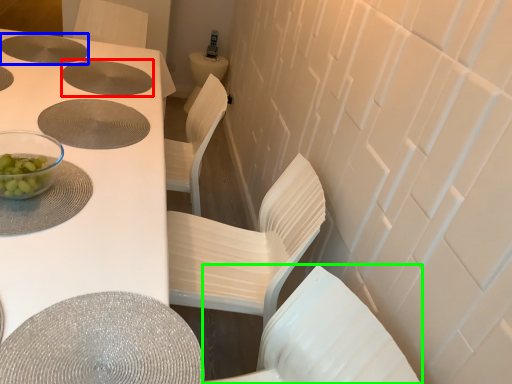
Question: Which object is positioned closest to hole (highlighted by a red box)? Select from hole (highlighted by a blue box) and chair (highlighted by a green box).

Choices:
 (A) hole
 (B) chair

Answer: (A)